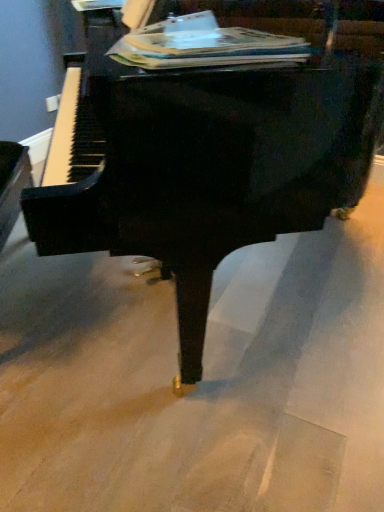
The image size is (384, 512). I want to click on vacant space underneath black polished piano at center (from a real-world perspective), so click(x=262, y=286).